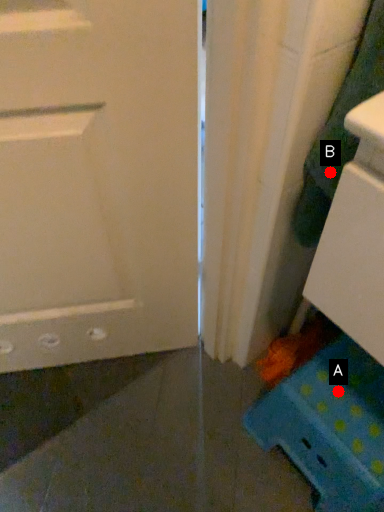
Question: Two points are circled on the image, labeled by A and B beside each circle. Which point is closer to the camera taking this photo?

Choices:
 (A) A is closer
 (B) B is closer

Answer: (B)